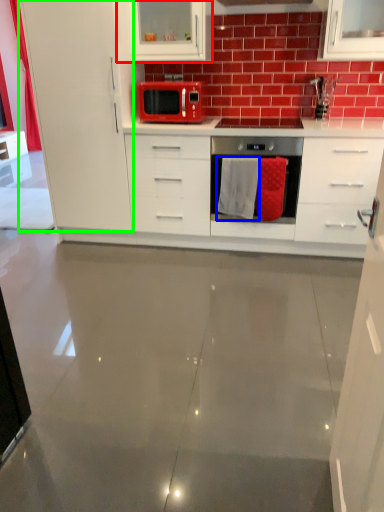
Question: Which is nearer to the cabinetry (highlighted by a red box)? material (highlighted by a blue box) or cabinetry (highlighted by a green box).

Choices:
 (A) material
 (B) cabinetry

Answer: (B)